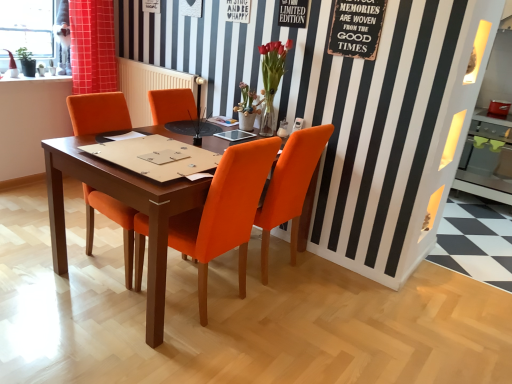
Find the location of `free space in front of orange fabric chair at center, positioned as the 2th chair in left-to-right order`. free space in front of orange fabric chair at center, positioned as the 2th chair in left-to-right order is located at coordinates (180, 355).